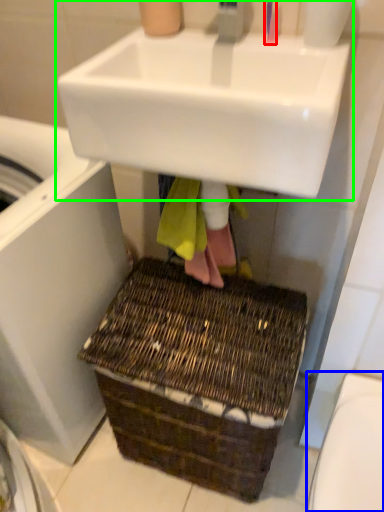
Question: Based on their relative distances, which object is farther from toothbrush (highlighted by a red box)? Choose from toilet bowl (highlighted by a blue box) and sink (highlighted by a green box).

Choices:
 (A) toilet bowl
 (B) sink

Answer: (A)